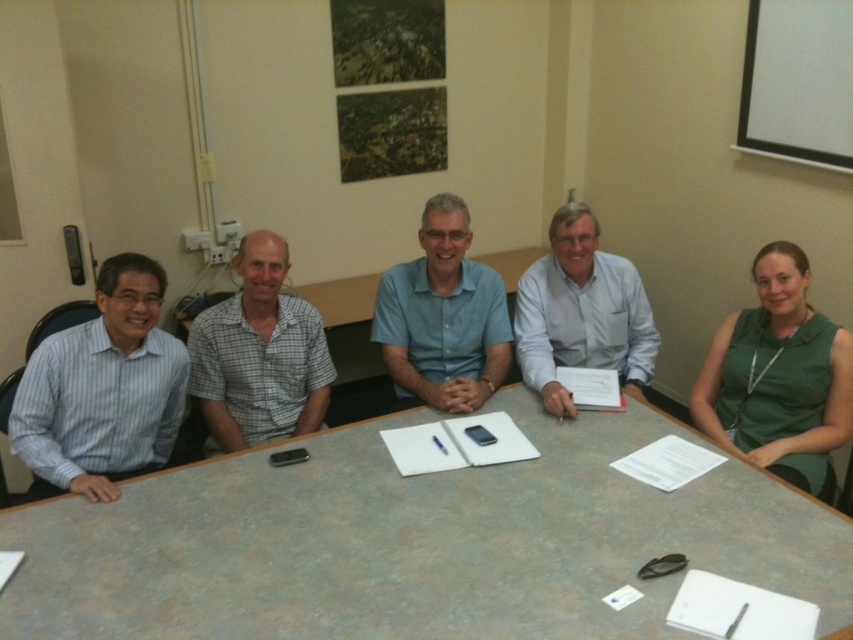
Question: Which object is the farthest from the blue striped shirt at left?

Choices:
 (A) smooth gray table at center
 (B) green sleeveless top at right

Answer: (B)

Question: Which is nearer to the green sleeveless top at right?

Choices:
 (A) white shirt at center
 (B) blue striped shirt at left

Answer: (A)

Question: Is the position of smooth gray table at center more distant than that of green sleeveless top at right?

Choices:
 (A) no
 (B) yes

Answer: (A)

Question: In this image, where is blue cotton shirt at center located relative to white shirt at center?

Choices:
 (A) above
 (B) below

Answer: (A)

Question: Among these objects, which one is nearest to the camera?

Choices:
 (A) blue striped shirt at left
 (B) white shirt at center

Answer: (A)

Question: Is checkered fabric shirt at center closer to camera compared to white shirt at center?

Choices:
 (A) yes
 (B) no

Answer: (B)